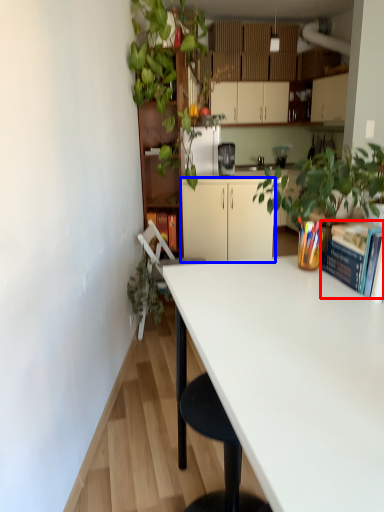
Question: Which point is closer to the camera, paperback book (highlighted by a red box) or cabinetry (highlighted by a blue box)?

Choices:
 (A) paperback book
 (B) cabinetry

Answer: (A)